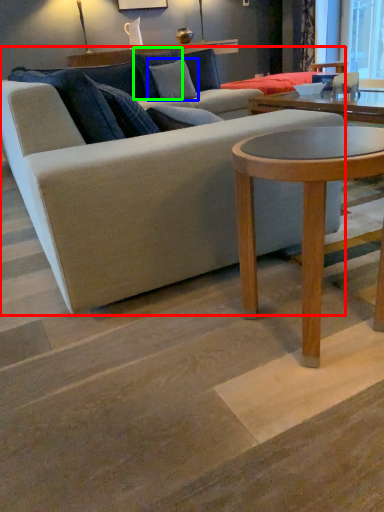
Question: Which object is the farthest from studio couch (highlighted by a red box)? Choose among these: pillow (highlighted by a blue box) or pillow (highlighted by a green box).

Choices:
 (A) pillow
 (B) pillow

Answer: (B)